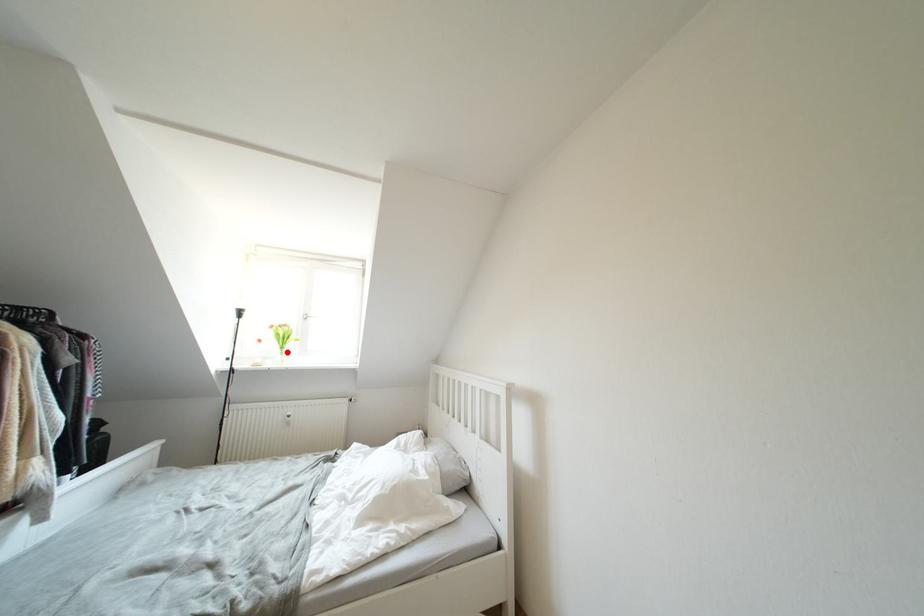
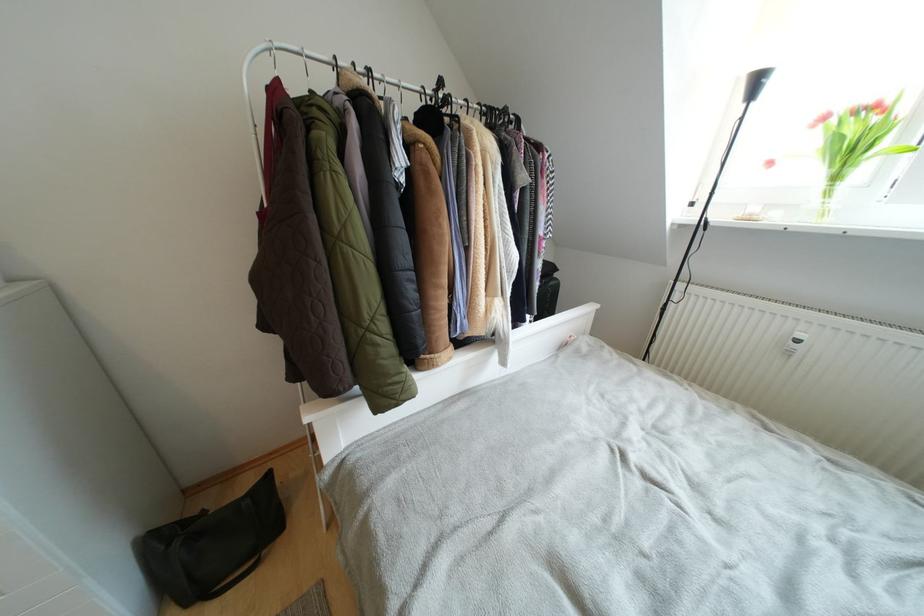
Locate, in the second image, the point that corresponds to the highlighted location in the first image.

(840, 182)